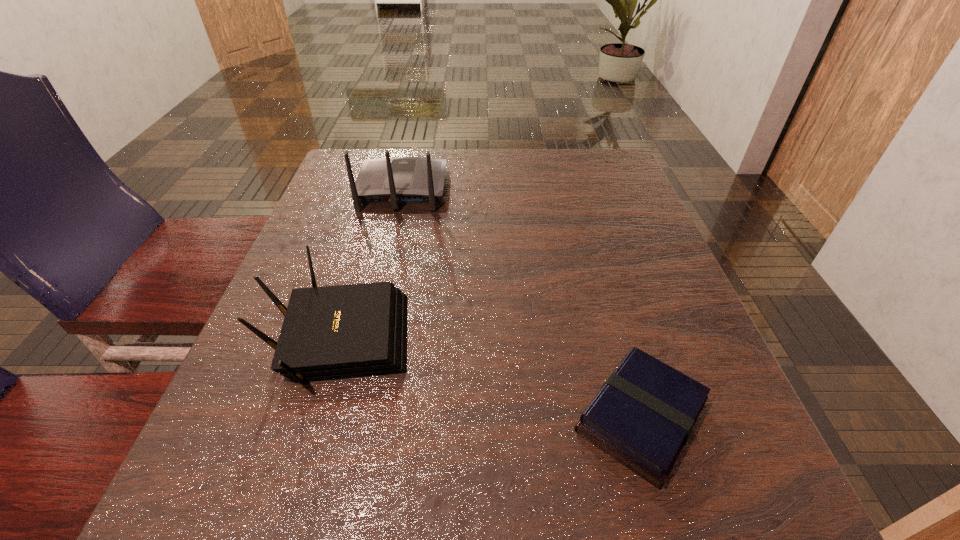
Identify the location of object located at the far edge. Image resolution: width=960 pixels, height=540 pixels. (399, 180).

Identify the location of object positioned at the near edge. (643, 415).

Find the location of a particular element. object situated at the right edge is located at coordinates (643, 415).

Identify the location of object at the far left corner. (399, 180).

Find the location of a particular element. Image resolution: width=960 pixels, height=540 pixels. object positioned at the near right corner is located at coordinates (643, 415).

In the image, there is a desktop. Identify the location of free space at the far edge. The width and height of the screenshot is (960, 540). (424, 149).

The height and width of the screenshot is (540, 960). In the image, there is a desktop. What are the coordinates of `vacant space at the near edge` in the screenshot? It's located at (562, 526).

The width and height of the screenshot is (960, 540). I want to click on free location at the left edge, so click(x=306, y=261).

Image resolution: width=960 pixels, height=540 pixels. What are the coordinates of `free space at the right edge of the desktop` in the screenshot? It's located at click(x=683, y=332).

The width and height of the screenshot is (960, 540). I want to click on vacant region at the far left corner, so click(x=358, y=158).